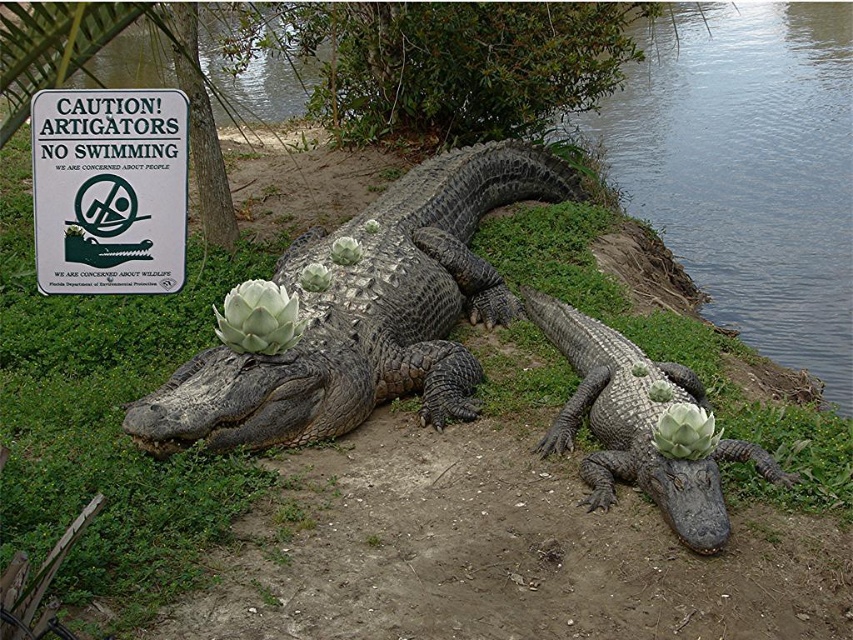
Can you confirm if clear water at lower right is thinner than matte gray crocodile at center?

Correct, clear water at lower right's width is less than matte gray crocodile at center's.

Does clear water at lower right appear on the right side of matte gray crocodile at center?

Indeed, clear water at lower right is positioned on the right side of matte gray crocodile at center.

What do you see at coordinates (749, 170) in the screenshot?
I see `clear water at lower right` at bounding box center [749, 170].

You are a GUI agent. You are given a task and a screenshot of the screen. Output one action in this format:
    pyautogui.click(x=<x>, y=<y>)
    Task: Click on the clear water at lower right
    This screenshot has width=853, height=640.
    Given the screenshot: What is the action you would take?
    pos(749,170)

Who is lower down, clear water at lower right or white paper sign at upper left?

white paper sign at upper left

Is clear water at lower right above white paper sign at upper left?

Correct, clear water at lower right is located above white paper sign at upper left.

Where is `clear water at lower right`? clear water at lower right is located at coordinates (749, 170).

Is clear water at lower right positioned at the back of dark gray textured crocodile at center?

Yes, clear water at lower right is behind dark gray textured crocodile at center.

Is point (833, 320) closer to viewer compared to point (262, 364)?

That is False.

I want to click on clear water at lower right, so click(x=749, y=170).